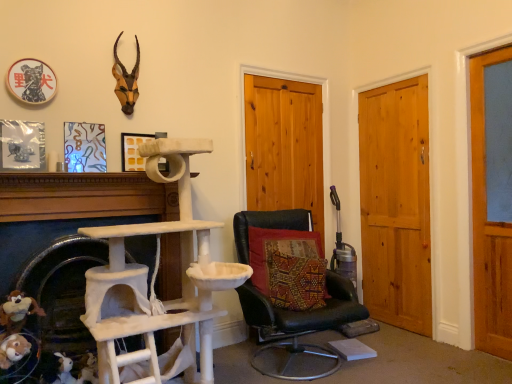
Question: From the image's perspective, would you say natural wood door at center right, the 2th door from the right, is shown under brown plush toy at lower left, positioned as the second toy in back-to-front order?

Choices:
 (A) no
 (B) yes

Answer: (A)

Question: Is natural wood door at center right, the 2th door from the right, located outside brown plush toy at lower left, positioned as the first toy in top-to-bottom order?

Choices:
 (A) yes
 (B) no

Answer: (A)

Question: Considering the relative sizes of natural wood door at center right, the 2th door from the right, and brown plush toy at lower left, positioned as the first toy in top-to-bottom order, in the image provided, is natural wood door at center right, the 2th door from the right, bigger than brown plush toy at lower left, positioned as the first toy in top-to-bottom order,?

Choices:
 (A) yes
 (B) no

Answer: (A)

Question: From the image's perspective, is natural wood door at center right, marked as the second door in a left-to-right arrangement, above brown plush toy at lower left, arranged as the second toy when viewed from the right?

Choices:
 (A) yes
 (B) no

Answer: (A)

Question: Is natural wood door at center right, the 2th door from the right, touching brown plush toy at lower left, arranged as the second toy when viewed from the right?

Choices:
 (A) yes
 (B) no

Answer: (B)

Question: In the image, is black leather chair at center on the left side or the right side of white fabric cat tree at left?

Choices:
 (A) left
 (B) right

Answer: (B)

Question: From a real-world perspective, is black leather chair at center physically located above or below white fabric cat tree at left?

Choices:
 (A) below
 (B) above

Answer: (A)

Question: Is black leather chair at center spatially inside white fabric cat tree at left, or outside of it?

Choices:
 (A) inside
 (B) outside

Answer: (B)

Question: In terms of size, does black leather chair at center appear bigger or smaller than white fabric cat tree at left?

Choices:
 (A) big
 (B) small

Answer: (A)

Question: Considering their positions, is white fabric cat tree at left located in front of or behind wooden door at center, which is the first door from left to right?

Choices:
 (A) behind
 (B) front

Answer: (B)

Question: From a real-world perspective, is white fabric cat tree at left positioned above or below wooden door at center, which is counted as the third door, starting from the right?

Choices:
 (A) above
 (B) below

Answer: (B)

Question: Based on their positions, is white fabric cat tree at left located to the left or right of wooden door at center, which is counted as the third door, starting from the right?

Choices:
 (A) right
 (B) left

Answer: (B)

Question: Based on their sizes in the image, would you say white fabric cat tree at left is bigger or smaller than wooden door at center, which is the first door from left to right?

Choices:
 (A) small
 (B) big

Answer: (B)

Question: In terms of height, does brown plush toy at lower left, which is the 1th toy in left-to-right order, look taller or shorter compared to white fabric cat tree at left?

Choices:
 (A) short
 (B) tall

Answer: (A)

Question: Considering the positions of brown plush toy at lower left, positioned as the first toy in top-to-bottom order, and white fabric cat tree at left in the image, is brown plush toy at lower left, positioned as the first toy in top-to-bottom order, wider or thinner than white fabric cat tree at left?

Choices:
 (A) wide
 (B) thin

Answer: (B)